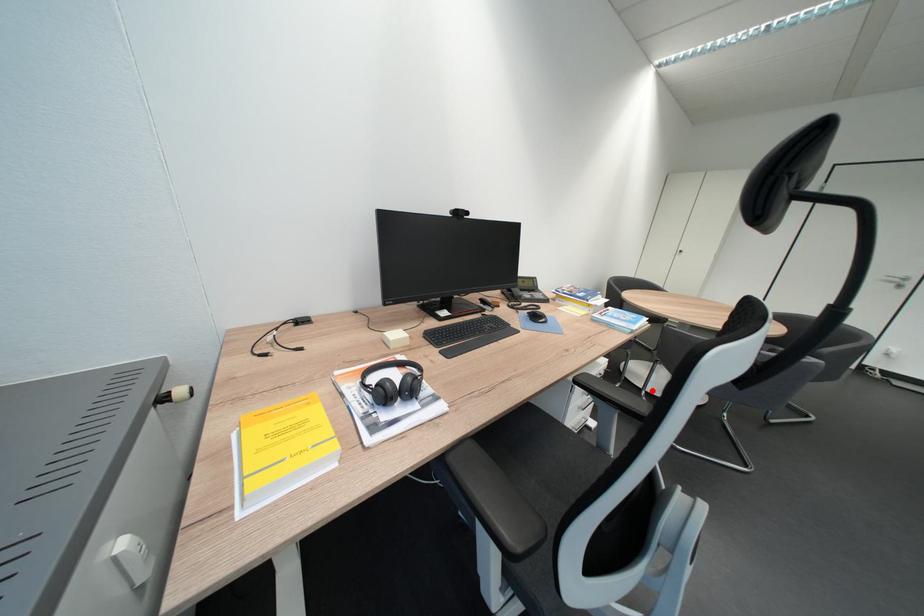
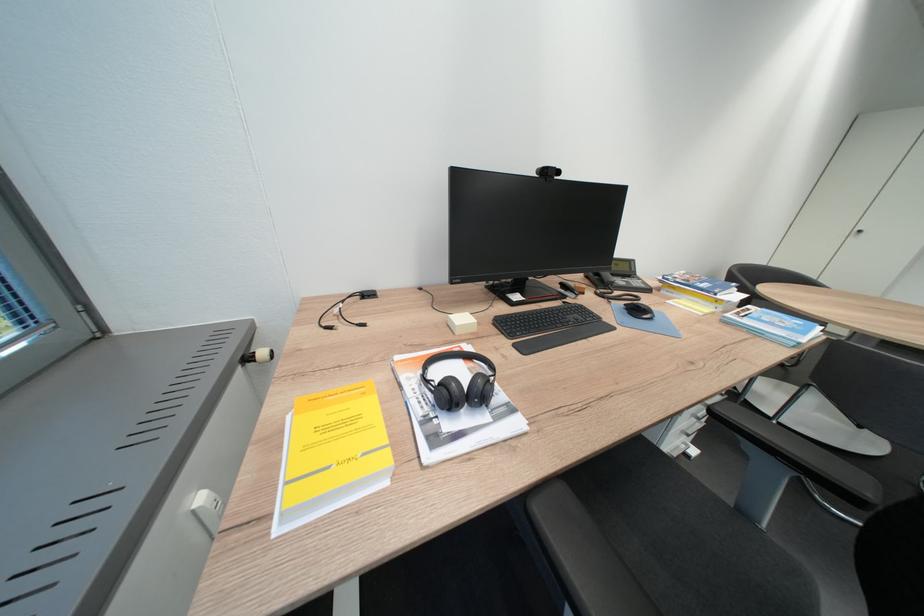
Question: I am providing you with two images of the same scene from different viewpoints. A red point is shown in image1. For the corresponding object point in image2, is it positioned nearer or farther from the camera?

Choices:
 (A) Nearer
 (B) Farther

Answer: (A)